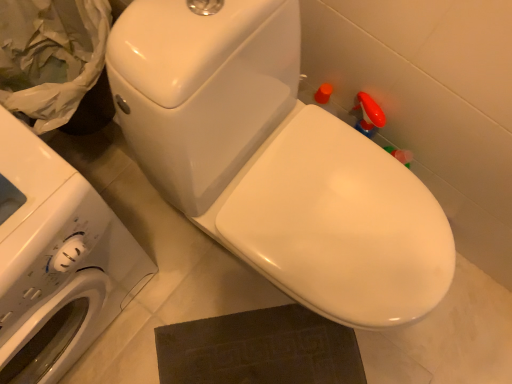
Question: Is point (18, 236) positioned closer to the camera than point (262, 198)?

Choices:
 (A) closer
 (B) farther

Answer: (A)

Question: Considering the positions of white glossy washing machine at left and white glossy toilet at center in the image, is white glossy washing machine at left taller or shorter than white glossy toilet at center?

Choices:
 (A) short
 (B) tall

Answer: (B)

Question: Would you say white glossy washing machine at left is to the left or to the right of white glossy toilet at center in the picture?

Choices:
 (A) right
 (B) left

Answer: (B)

Question: Considering the positions of point (290, 182) and point (50, 324), is point (290, 182) closer or farther from the camera than point (50, 324)?

Choices:
 (A) farther
 (B) closer

Answer: (A)

Question: In terms of height, does white glossy toilet at center look taller or shorter compared to white glossy washing machine at left?

Choices:
 (A) short
 (B) tall

Answer: (A)

Question: Considering the relative positions of white glossy toilet at center and white glossy washing machine at left in the image provided, is white glossy toilet at center to the left or to the right of white glossy washing machine at left?

Choices:
 (A) right
 (B) left

Answer: (A)

Question: Is white glossy toilet at center spatially inside white glossy washing machine at left, or outside of it?

Choices:
 (A) outside
 (B) inside

Answer: (A)